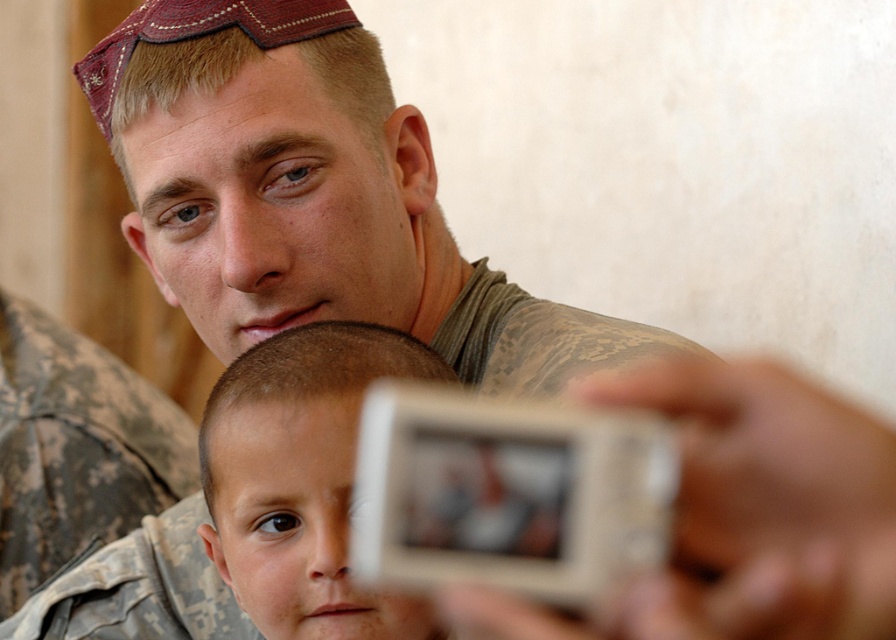
You are a photographer trying to capture a candid shot of the smooth skin boy at center and the camouflage fabric uniform at upper center. Based on their positions, which subject is closer to the camera?

The smooth skin boy at center is closer to the camera because he is positioned below the camouflage fabric uniform at upper center, indicating he is in the foreground.

What is located at the coordinate point (302,480) in the image?

The point (302,480) indicates smooth skin boy at center.